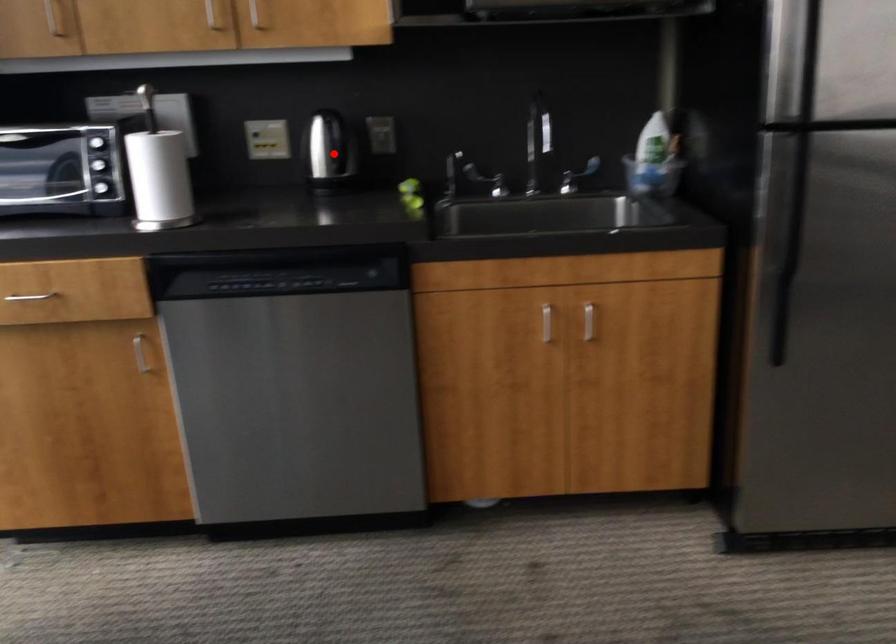
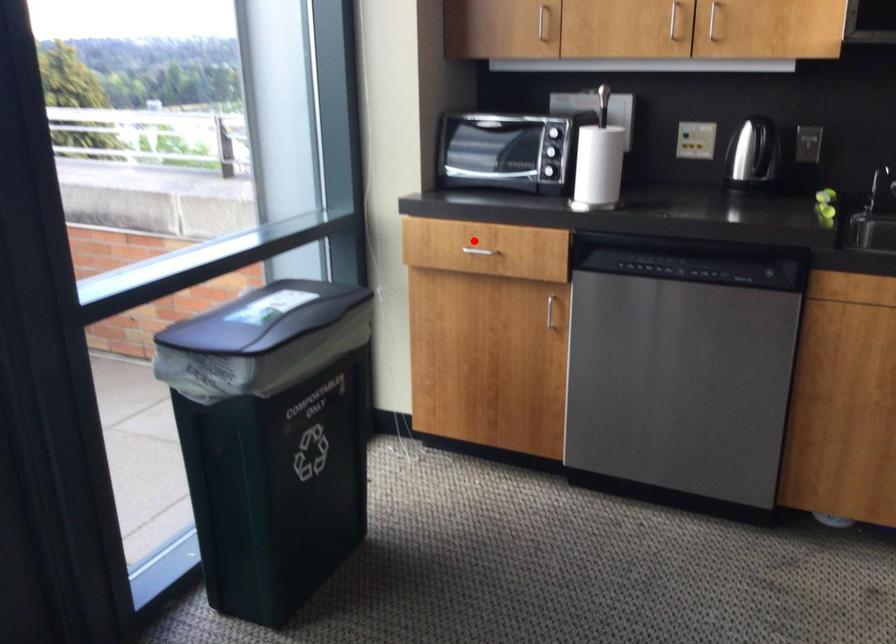
I am providing you with two images of the same scene from different viewpoints. A red point is marked on the first image and another point is marked on the second image. Are the points marked in image1 and image2 representing the same 3D position?

No